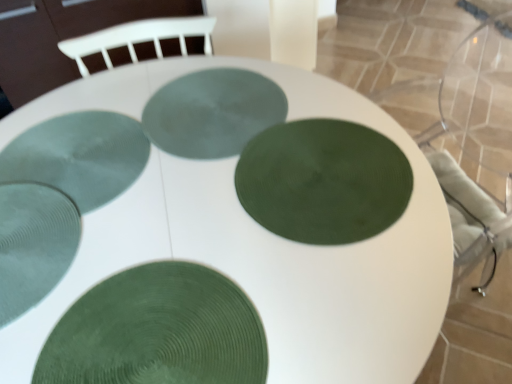
Question: From the image's perspective, relative to clear textured glass at bottom left, positioned as the 2th glass plate in front-to-back order, is green textured glass plate at center, arranged as the fourth glass plate when viewed from the front, above or below?

Choices:
 (A) below
 (B) above

Answer: (B)

Question: In the image, is green textured glass plate at center, positioned as the 2th glass plate in back-to-front order, on the left side or the right side of clear textured glass at bottom left, positioned as the 2th glass plate in front-to-back order?

Choices:
 (A) right
 (B) left

Answer: (A)

Question: Estimate the real-world distances between objects in this image. Which object is farther from the clear textured glass at bottom left, the fourth glass plate from the back?

Choices:
 (A) green textured plate at center, which appears as the first glass plate when viewed from the front
 (B) green textured glass plate at center, which ranks as the third glass plate in front-to-back order
 (C) green textured glass plate at center, which appears as the 5th glass plate when viewed from the front
 (D) green textured glass plate at center, positioned as the 2th glass plate in back-to-front order

Answer: (B)

Question: Which is farther from the green textured glass plate at center, arranged as the fourth glass plate when viewed from the front?

Choices:
 (A) green textured glass plate at center, positioned as the 3th glass plate in back-to-front order
 (B) clear textured glass at bottom left, positioned as the 2th glass plate in front-to-back order
 (C) green textured glass plate at center, which is the 1th glass plate in back-to-front order
 (D) green textured plate at center, which is the 5th glass plate from back to front

Answer: (A)